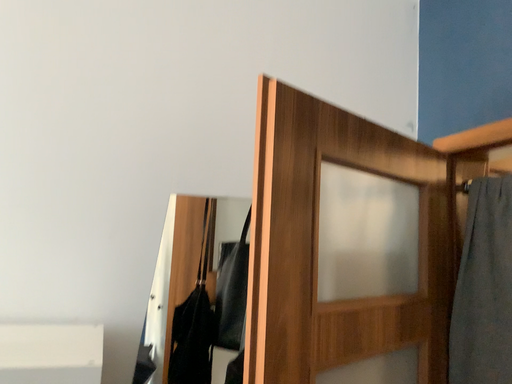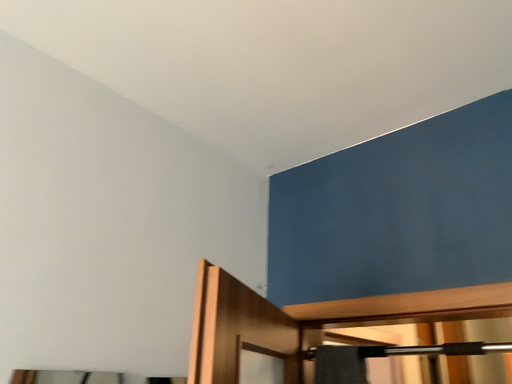
Question: How did the camera likely rotate when shooting the video?

Choices:
 (A) rotated downward
 (B) rotated upward

Answer: (B)